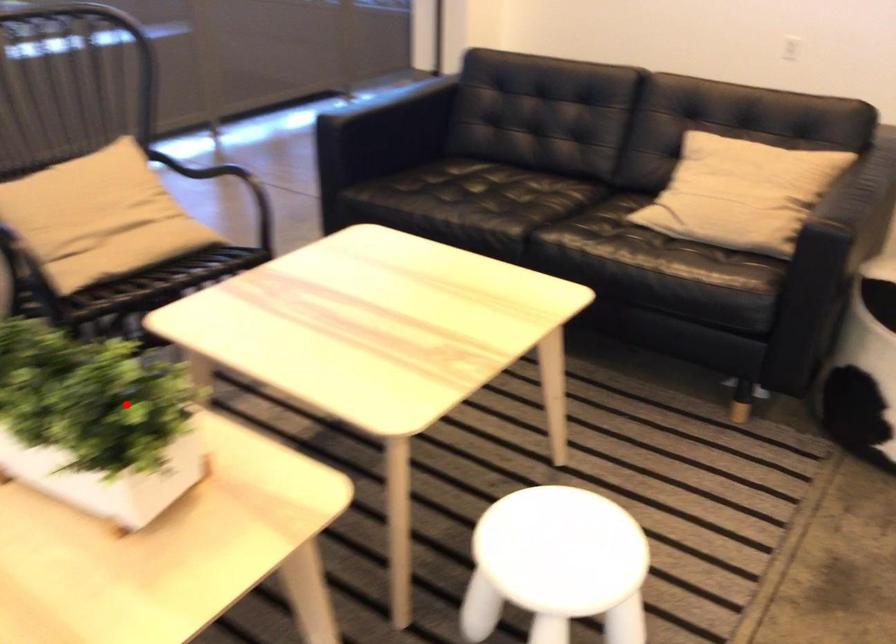
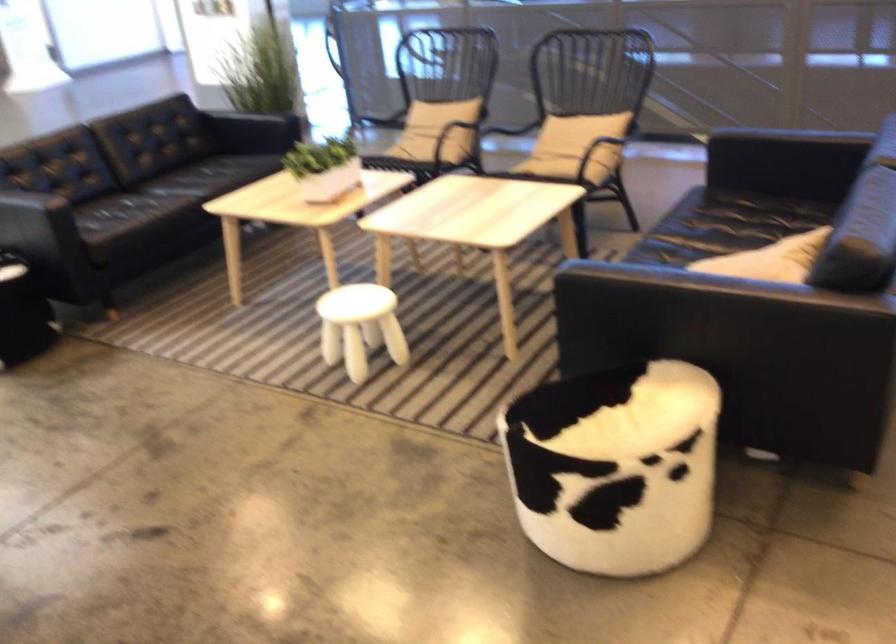
Question: I am providing you with two images of the same scene from different viewpoints. Image1 has a red point marked. In image2, the corresponding 3D location appears at what relative position? Reply with the corresponding letter.

Choices:
 (A) Closer
 (B) Farther

Answer: (B)